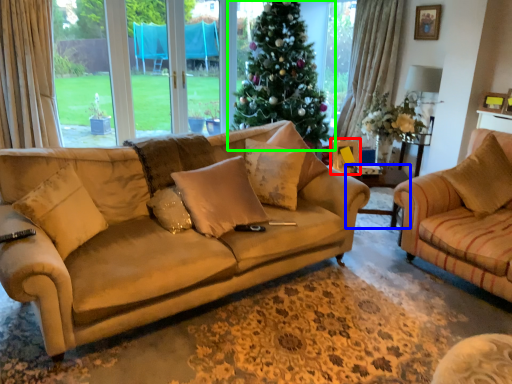
Question: Which object is positioned farthest from picture frame (highlighted by a red box)? Select from side table (highlighted by a blue box) and christmas tree (highlighted by a green box).

Choices:
 (A) side table
 (B) christmas tree

Answer: (B)